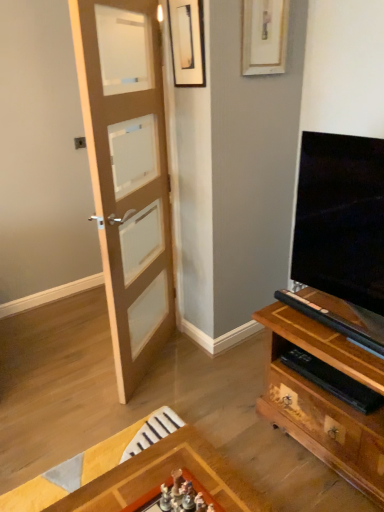
Question: Should I look upward or downward to see wooden picture frame at upper center, the first picture frame when ordered from right to left?

Choices:
 (A) up
 (B) down

Answer: (A)

Question: Is light brown wooden door at left closer to the viewer compared to wooden picture frame at upper center, which appears as the 2th picture frame when viewed from the left?

Choices:
 (A) no
 (B) yes

Answer: (B)

Question: Is light brown wooden door at left further to camera compared to wooden picture frame at upper center, which appears as the 2th picture frame when viewed from the left?

Choices:
 (A) no
 (B) yes

Answer: (A)

Question: Is light brown wooden door at left wider than wooden picture frame at upper center, the first picture frame when ordered from right to left?

Choices:
 (A) no
 (B) yes

Answer: (B)

Question: Does light brown wooden door at left have a lesser height compared to wooden picture frame at upper center, the first picture frame when ordered from right to left?

Choices:
 (A) no
 (B) yes

Answer: (A)

Question: From a real-world perspective, is light brown wooden door at left physically above wooden picture frame at upper center, the first picture frame when ordered from right to left?

Choices:
 (A) yes
 (B) no

Answer: (B)

Question: Could you tell me if light brown wooden door at left is turned towards wooden picture frame at upper center, the first picture frame when ordered from right to left?

Choices:
 (A) yes
 (B) no

Answer: (B)

Question: Is matte black picture frame at upper center, the 1th picture frame in the left-to-right sequence, thinner than light brown wooden door at left?

Choices:
 (A) yes
 (B) no

Answer: (A)

Question: Is matte black picture frame at upper center, the 1th picture frame in the left-to-right sequence, to the left of light brown wooden door at left from the viewer's perspective?

Choices:
 (A) no
 (B) yes

Answer: (A)

Question: Can you confirm if matte black picture frame at upper center, the 2th picture frame when ordered from right to left, is smaller than light brown wooden door at left?

Choices:
 (A) yes
 (B) no

Answer: (A)

Question: Is matte black picture frame at upper center, the 2th picture frame when ordered from right to left, taller than light brown wooden door at left?

Choices:
 (A) yes
 (B) no

Answer: (B)

Question: Does matte black picture frame at upper center, the 1th picture frame in the left-to-right sequence, have a larger size compared to light brown wooden door at left?

Choices:
 (A) yes
 (B) no

Answer: (B)

Question: Does matte black picture frame at upper center, the 2th picture frame when ordered from right to left, turn towards light brown wooden door at left?

Choices:
 (A) yes
 (B) no

Answer: (A)

Question: Would you say matte black picture frame at upper center, the 2th picture frame when ordered from right to left, is a long distance from wooden picture frame at upper center, which appears as the 2th picture frame when viewed from the left?

Choices:
 (A) yes
 (B) no

Answer: (B)